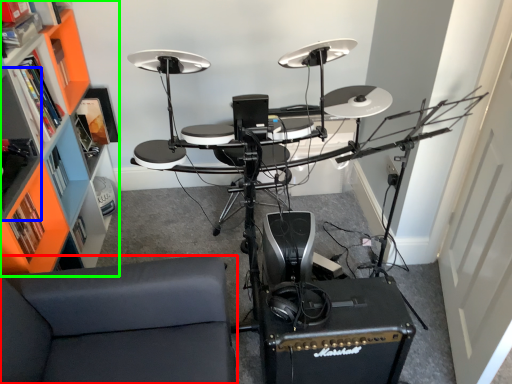
Question: Which object is positioned farthest from furniture (highlighted by a red box)? Select from shelf (highlighted by a blue box) and bookshelf (highlighted by a green box).

Choices:
 (A) shelf
 (B) bookshelf

Answer: (B)